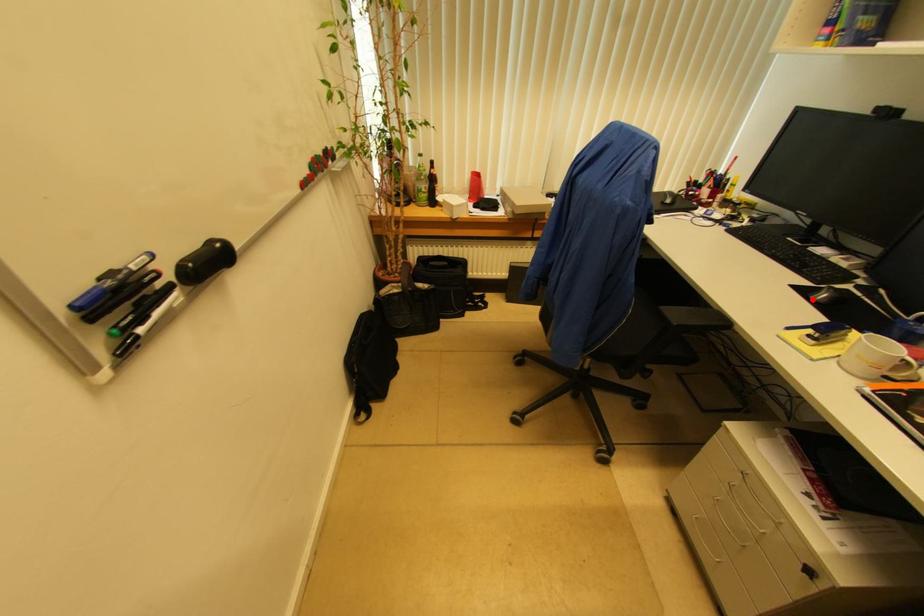
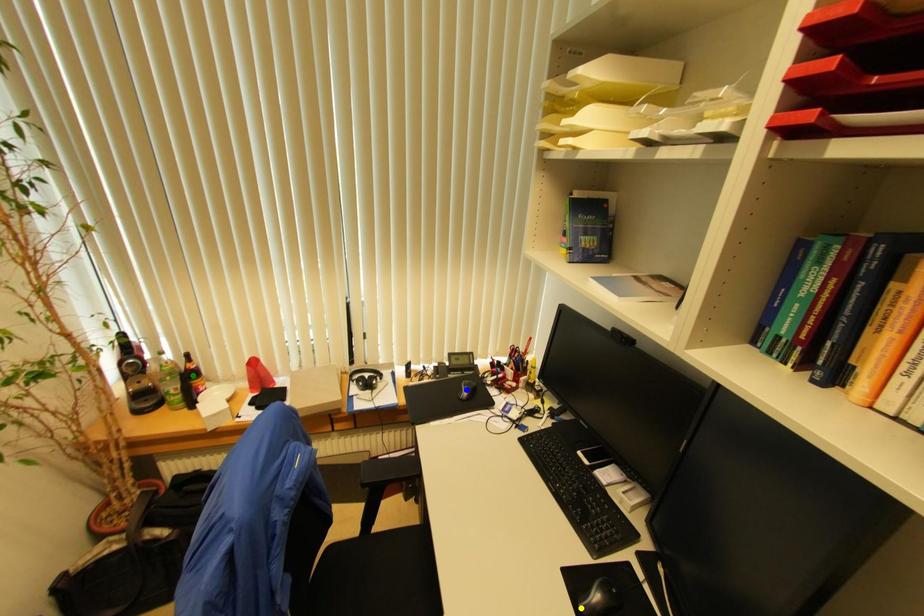
Question: I am providing you with two images of the same scene from different viewpoints. A red point is marked on the first image. You are given multiple points on the second image. Which mark in image 2 goes with the point in image 1?

Choices:
 (A) green point
 (B) blue point
 (C) yellow point

Answer: (C)